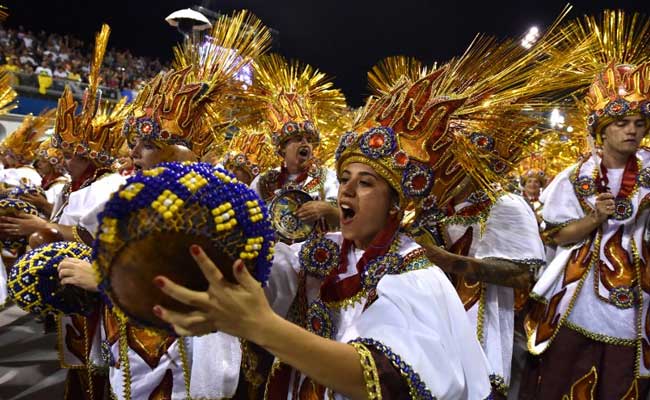
The width and height of the screenshot is (650, 400). In order to click on lights in this screenshot , I will do `click(530, 36)`, `click(552, 123)`.